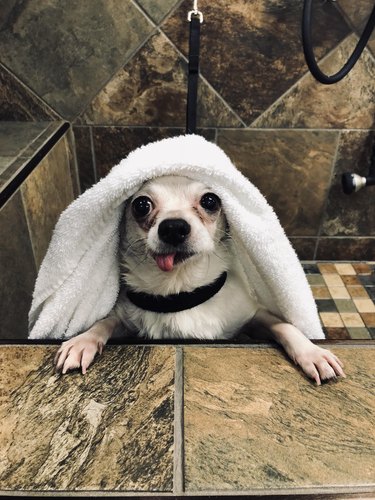
The image size is (375, 500). Identify the location of mixed tile floor. (346, 294).